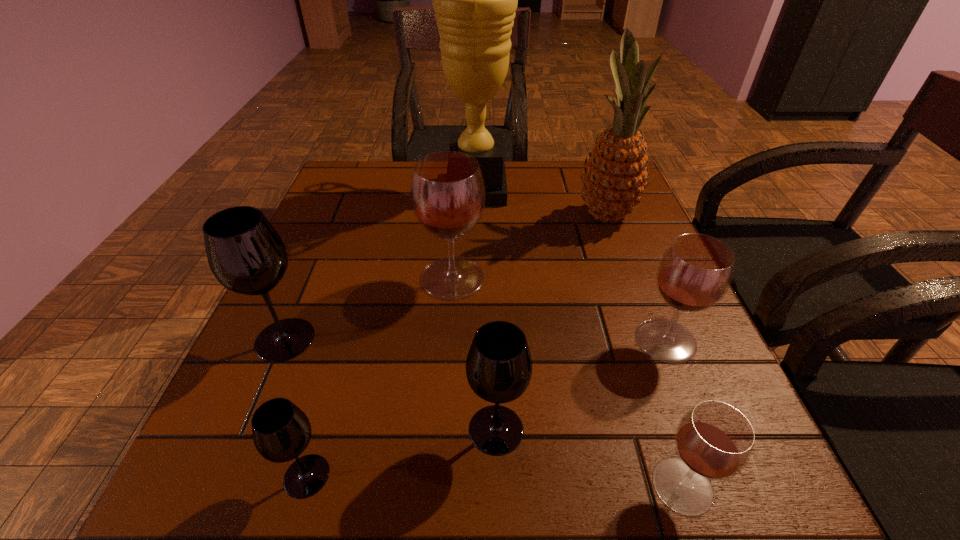
In the image, there is a desktop. Where is `vacant space at the near left corner`? vacant space at the near left corner is located at coordinates (243, 466).

In the image, there is a desktop. In order to click on vacant space at the near right corner in this screenshot , I will do `click(731, 520)`.

Locate an element on the screen. The width and height of the screenshot is (960, 540). free space between the pineapple and the second nearest red wineglass is located at coordinates (636, 278).

I want to click on free point between the biggest red wineglass and the leftmost gray wineglass, so click(x=369, y=309).

The height and width of the screenshot is (540, 960). In order to click on vacant region between the tallest object and the nearest red wineglass in this screenshot , I will do `click(580, 337)`.

The image size is (960, 540). Identify the location of empty location between the second gray wineglass from right to left and the nearest red wineglass. (494, 481).

Locate an element on the screen. The image size is (960, 540). free space between the second smallest red wineglass and the smallest red wineglass is located at coordinates (674, 413).

Identify which object is the sixth nearest to the second biggest red wineglass. Please provide its 2D coordinates. Your answer should be formatted as a tuple, i.e. [(x, y)], where the tuple contains the x and y coordinates of a point satisfying the conditions above.

[(281, 431)]

You are a GUI agent. You are given a task and a screenshot of the screen. Output one action in this format:
    pyautogui.click(x=<x>, y=<y>)
    Task: Click on the closest object to the trophy cup
    The height and width of the screenshot is (540, 960).
    Given the screenshot: What is the action you would take?
    pyautogui.click(x=615, y=175)

Find the location of a particular element. This screenshot has width=960, height=540. the fifth closest wineglass to the smallest gray wineglass is located at coordinates (694, 273).